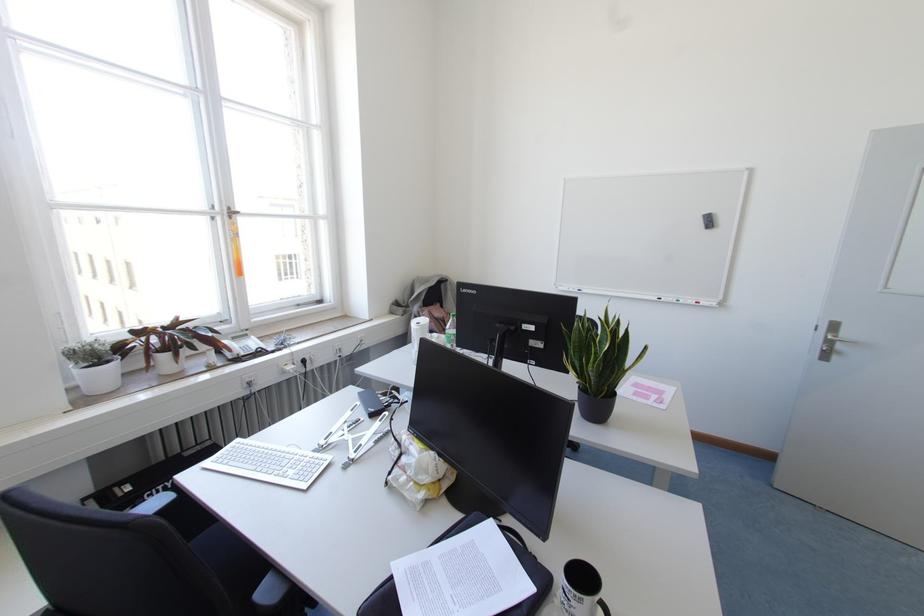
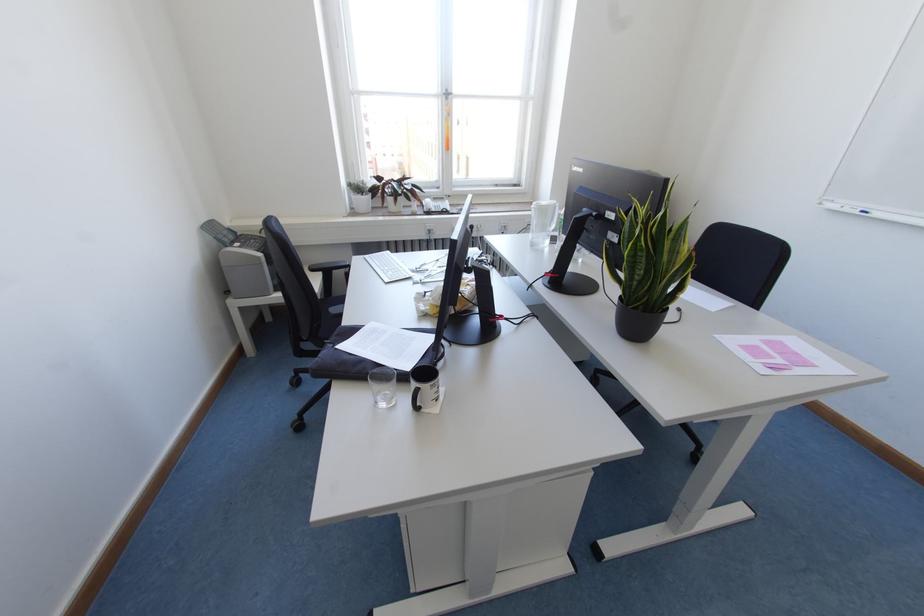
Find the pixel in the second image that matches the point at 237,439 in the first image.

(387, 251)